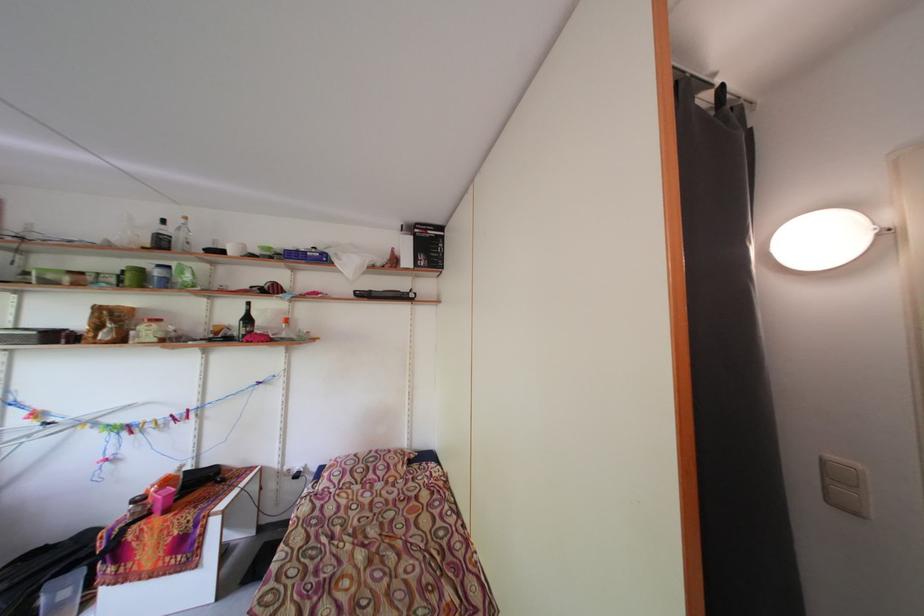
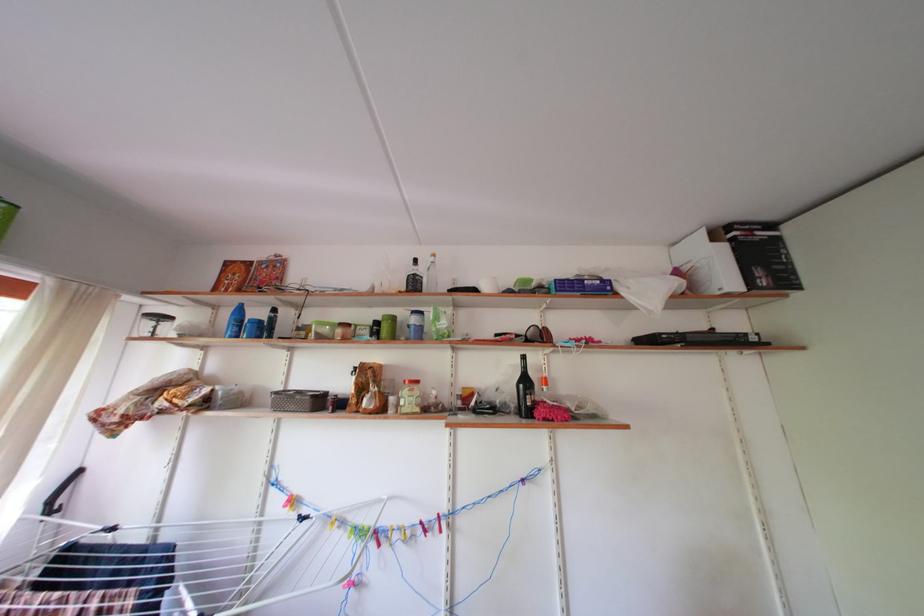
In the second image, find the point that corresponds to (256,325) in the first image.

(533, 387)